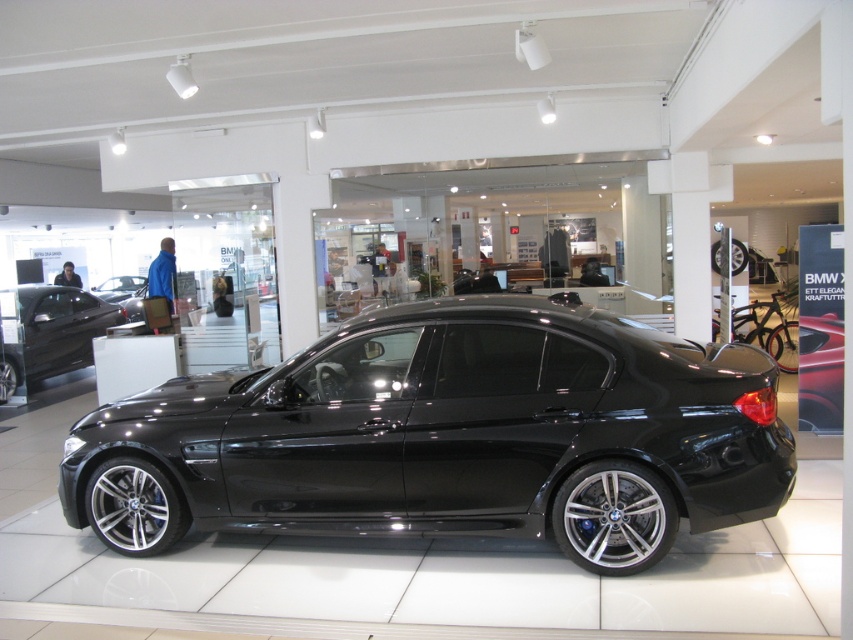
You are a customer in the showroom and want to know which car has more space inside. Based on their sizes, which car between the matte black sedan at left and the glossy black car at center would likely have a larger cabin?

The matte black sedan at left is bigger than the glossy black car at center, so it likely has a larger cabin.

You are a customer in the showroom and want to take a photo of the black metallic car at center. If you stand at the entrance of the showroom, which is located at point 0.0, 0.0, where should you position yourself to capture the entire car in your camera frame? Please provide the coordinates based on the showroom layout described.

To capture the entire black metallic car at center positioned at coordinates (448, 436), you should position yourself at a point that allows the camera frame to encompass the car. Since the entrance is at (0, 0), moving towards the car while maintaining a distance ensures the car fits within the frame. The exact coordinates depend on the camera angle and zoom, but positioning yourself around (340, 320) would provide a balanced view.

You are standing in the showroom and want to determine which of the two points, point (671, 536) or point (57, 339), is nearer to you. Based on the car and showroom layout, which point is closer?

Point (671, 536) is closer to the viewer than point (57, 339).